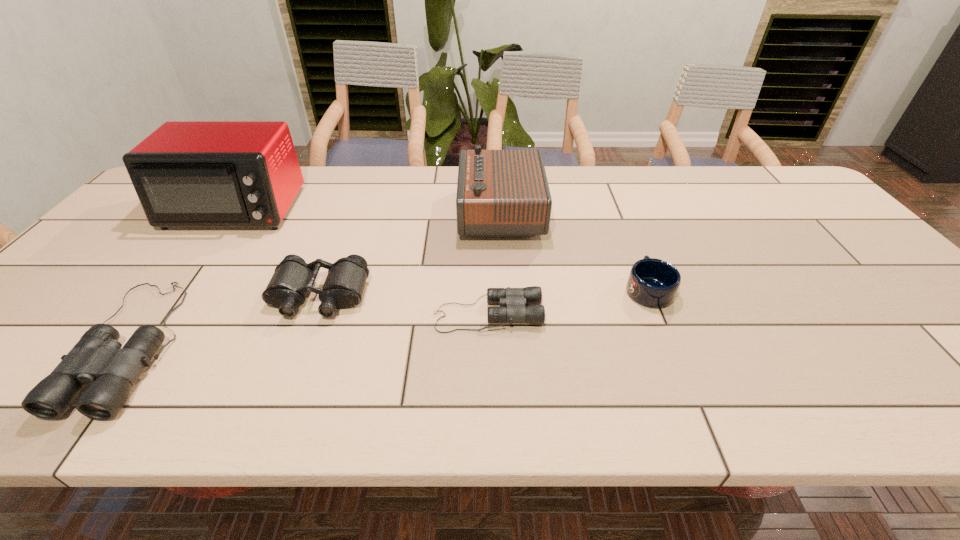
Please point a free position for a binoculars on the right. Please provide its 2D coordinates. Your answer should be formatted as a tuple, i.e. [(x, y)], where the tuple contains the x and y coordinates of a point satisfying the conditions above.

[(802, 289)]